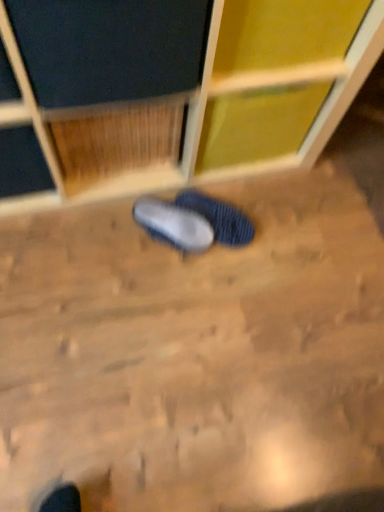
Question: From the image's perspective, is blue knitted slipper at center, which is the 1th footwear from right to left, located above blue fabric slipper at center, the first footwear viewed from the left?

Choices:
 (A) no
 (B) yes

Answer: (B)

Question: Does blue knitted slipper at center, which appears as the second footwear when viewed from the left, have a smaller size compared to blue fabric slipper at center, the first footwear viewed from the left?

Choices:
 (A) yes
 (B) no

Answer: (B)

Question: Considering the relative sizes of blue knitted slipper at center, which is the 1th footwear from right to left, and blue fabric slipper at center, which is the 2th footwear from right to left, in the image provided, is blue knitted slipper at center, which is the 1th footwear from right to left, shorter than blue fabric slipper at center, which is the 2th footwear from right to left,?

Choices:
 (A) yes
 (B) no

Answer: (B)

Question: Is blue knitted slipper at center, which is the 1th footwear from right to left, aimed at blue fabric slipper at center, the first footwear viewed from the left?

Choices:
 (A) yes
 (B) no

Answer: (B)

Question: Does blue knitted slipper at center, which appears as the second footwear when viewed from the left, appear on the right side of blue fabric slipper at center, which is the 2th footwear from right to left?

Choices:
 (A) yes
 (B) no

Answer: (A)

Question: Are blue knitted slipper at center, which appears as the second footwear when viewed from the left, and blue fabric slipper at center, the first footwear viewed from the left, making contact?

Choices:
 (A) no
 (B) yes

Answer: (B)

Question: Is blue fabric slipper at center, which is the 2th footwear from right to left, taller than blue knitted slipper at center, which appears as the second footwear when viewed from the left?

Choices:
 (A) no
 (B) yes

Answer: (A)

Question: Considering the relative sizes of blue fabric slipper at center, which is the 2th footwear from right to left, and blue knitted slipper at center, which appears as the second footwear when viewed from the left, in the image provided, is blue fabric slipper at center, which is the 2th footwear from right to left, shorter than blue knitted slipper at center, which appears as the second footwear when viewed from the left,?

Choices:
 (A) no
 (B) yes

Answer: (B)

Question: Is blue fabric slipper at center, the first footwear viewed from the left, positioned beyond the bounds of blue knitted slipper at center, which is the 1th footwear from right to left?

Choices:
 (A) yes
 (B) no

Answer: (A)

Question: From a real-world perspective, does blue fabric slipper at center, which is the 2th footwear from right to left, sit lower than blue knitted slipper at center, which is the 1th footwear from right to left?

Choices:
 (A) yes
 (B) no

Answer: (B)

Question: Does blue fabric slipper at center, which is the 2th footwear from right to left, have a smaller size compared to blue knitted slipper at center, which is the 1th footwear from right to left?

Choices:
 (A) no
 (B) yes

Answer: (B)

Question: Can you confirm if blue fabric slipper at center, the first footwear viewed from the left, is positioned to the right of blue knitted slipper at center, which appears as the second footwear when viewed from the left?

Choices:
 (A) no
 (B) yes

Answer: (A)

Question: In terms of height, does blue knitted slipper at center, which appears as the second footwear when viewed from the left, look taller or shorter compared to blue fabric slipper at center, the first footwear viewed from the left?

Choices:
 (A) short
 (B) tall

Answer: (B)